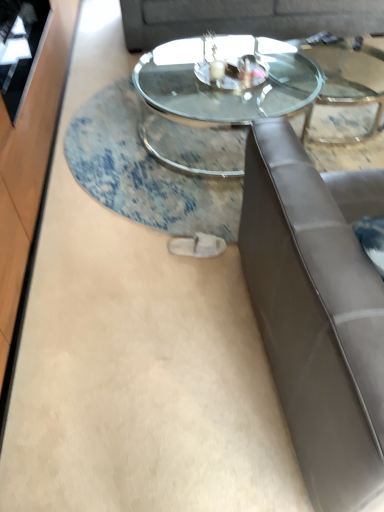
Question: Is transparent glass door at left behind transparent glass coffee table at center?

Choices:
 (A) no
 (B) yes

Answer: (A)

Question: From a real-world perspective, is transparent glass door at left positioned under transparent glass coffee table at center based on gravity?

Choices:
 (A) yes
 (B) no

Answer: (B)

Question: Is transparent glass door at left thinner than transparent glass coffee table at center?

Choices:
 (A) no
 (B) yes

Answer: (B)

Question: Considering the relative positions of transparent glass door at left and transparent glass coffee table at center in the image provided, is transparent glass door at left in front of transparent glass coffee table at center?

Choices:
 (A) yes
 (B) no

Answer: (A)

Question: Can you confirm if transparent glass door at left is positioned to the right of transparent glass coffee table at center?

Choices:
 (A) yes
 (B) no

Answer: (B)

Question: Based on their positions, is transparent glass door at left located to the left or right of transparent glass coffee table at center?

Choices:
 (A) left
 (B) right

Answer: (A)

Question: In terms of height, does transparent glass door at left look taller or shorter compared to transparent glass coffee table at center?

Choices:
 (A) short
 (B) tall

Answer: (B)

Question: Is point (38, 11) closer or farther from the camera than point (289, 74)?

Choices:
 (A) farther
 (B) closer

Answer: (B)

Question: Choose the correct answer: Is transparent glass door at left inside transparent glass coffee table at center or outside it?

Choices:
 (A) inside
 (B) outside

Answer: (B)

Question: From the image's perspective, relative to transparent glass coffee table at center, is suede gray couch at upper center above or below?

Choices:
 (A) above
 (B) below

Answer: (A)

Question: Based on their positions, is suede gray couch at upper center located to the left or right of transparent glass coffee table at center?

Choices:
 (A) left
 (B) right

Answer: (B)

Question: Is suede gray couch at upper center situated inside transparent glass coffee table at center or outside?

Choices:
 (A) outside
 (B) inside

Answer: (A)

Question: In terms of width, does suede gray couch at upper center look wider or thinner when compared to transparent glass coffee table at center?

Choices:
 (A) wide
 (B) thin

Answer: (B)

Question: From a real-world perspective, is transparent glass coffee table at center physically located above or below suede gray couch at upper center?

Choices:
 (A) above
 (B) below

Answer: (B)

Question: In terms of width, does transparent glass coffee table at center look wider or thinner when compared to suede gray couch at upper center?

Choices:
 (A) thin
 (B) wide

Answer: (B)